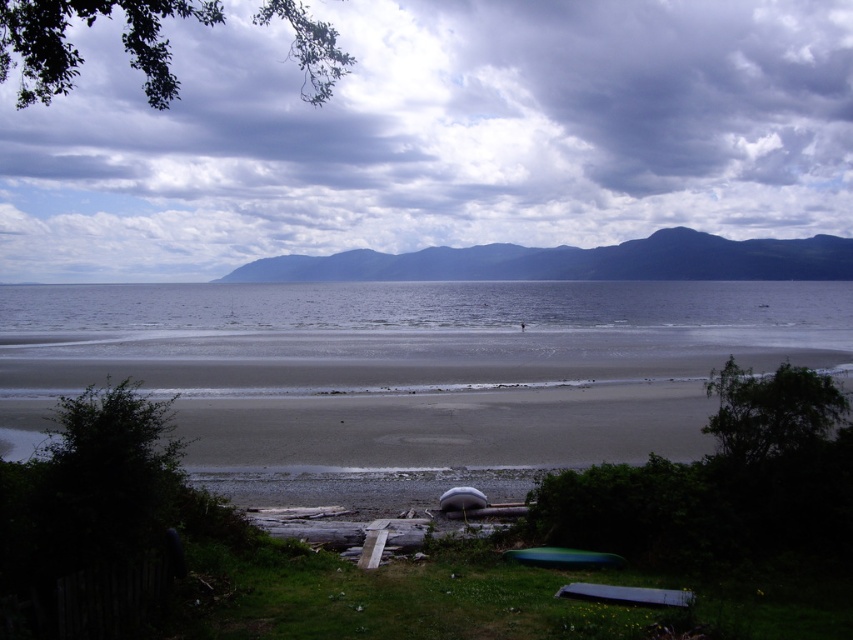
Can you confirm if cloudy sky at upper center is positioned to the right of dark green forested mountain at upper center?

In fact, cloudy sky at upper center is to the left of dark green forested mountain at upper center.

Does point (576, 65) lie behind point (776, 248)?

That is True.

What are the coordinates of `cloudy sky at upper center` in the screenshot? It's located at (434, 134).